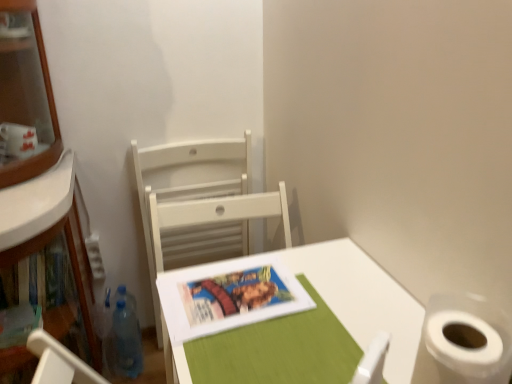
This screenshot has width=512, height=384. I want to click on free space underneath matte paper book cover at center (from a real-world perspective), so click(234, 303).